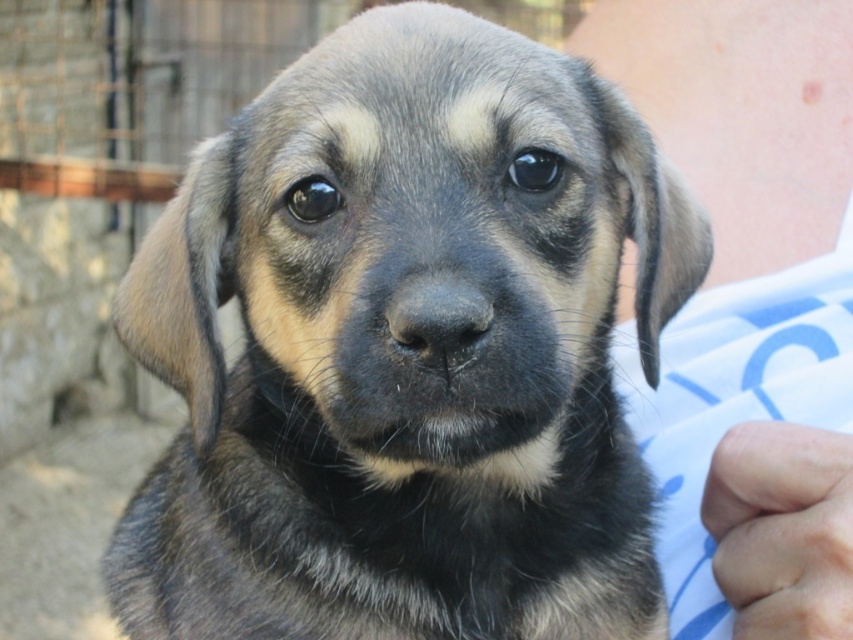
Is fuzzy fur puppy at center positioned behind smooth skin at upper right?

No, it is not.

Between fuzzy fur puppy at center and smooth skin at upper right, which one is positioned lower?

Positioned lower is fuzzy fur puppy at center.

The image size is (853, 640). I want to click on fuzzy fur puppy at center, so click(x=405, y=349).

Between fuzzy fur puppy at center and skinny flesh at lower right, which one is positioned lower?

Positioned lower is skinny flesh at lower right.

Who is positioned more to the left, fuzzy fur puppy at center or skinny flesh at lower right?

fuzzy fur puppy at center

The height and width of the screenshot is (640, 853). What are the coordinates of `fuzzy fur puppy at center` in the screenshot? It's located at [x=405, y=349].

Is smooth skin at upper right below skinny flesh at lower right?

Incorrect, smooth skin at upper right is not positioned below skinny flesh at lower right.

Is smooth skin at upper right positioned in front of skinny flesh at lower right?

No, smooth skin at upper right is behind skinny flesh at lower right.

Describe the element at coordinates (741, 113) in the screenshot. I see `smooth skin at upper right` at that location.

What are the coordinates of `smooth skin at upper right` in the screenshot? It's located at (741, 113).